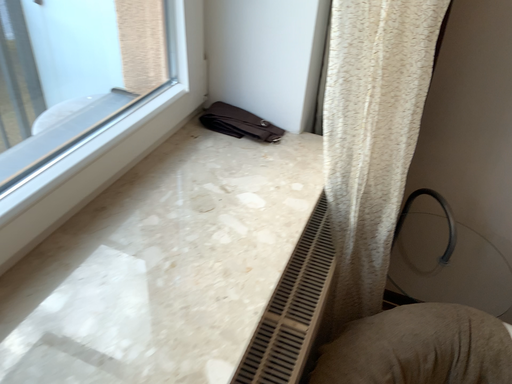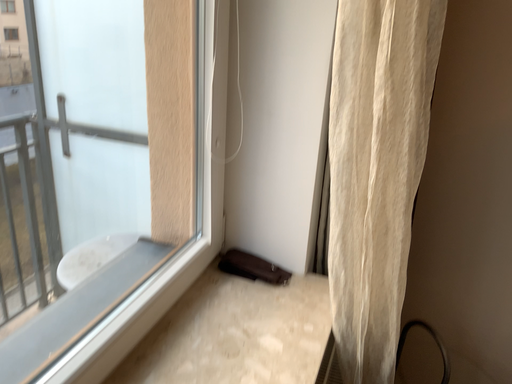
Question: How did the camera likely rotate when shooting the video?

Choices:
 (A) rotated downward
 (B) rotated upward

Answer: (B)